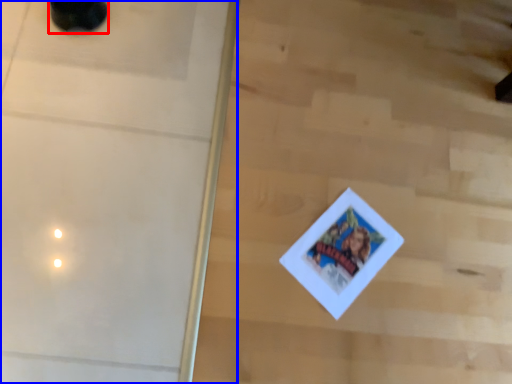
Question: Which object is closer to the camera taking this photo, footwear (highlighted by a red box) or screen door (highlighted by a blue box)?

Choices:
 (A) footwear
 (B) screen door

Answer: (B)